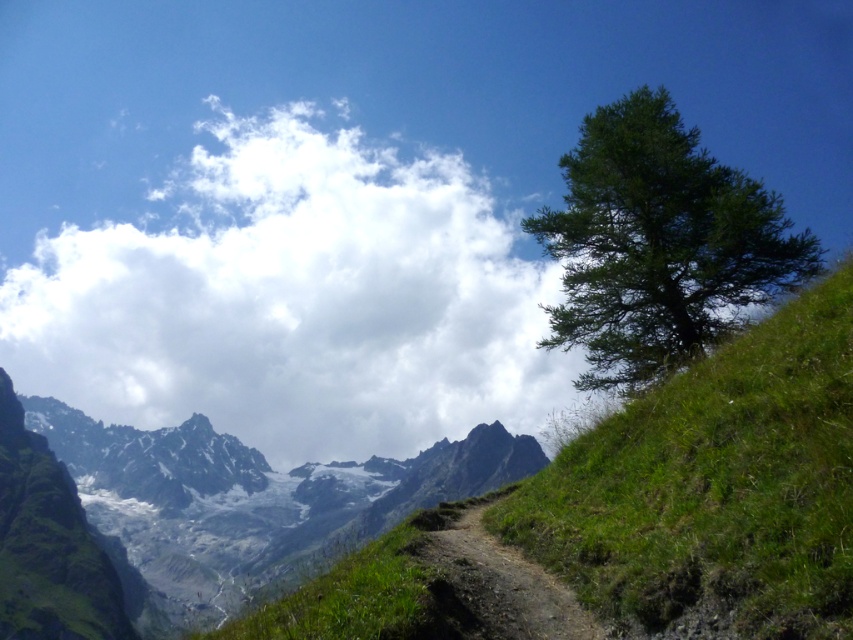
From the picture: Which is more to the right, green grassy hillside at right or snowy granite mountains at center?

green grassy hillside at right is more to the right.

Is point (796, 554) positioned after point (459, 493)?

No, it is in front of (459, 493).

Is point (846, 550) behind point (0, 417)?

No, (846, 550) is in front of (0, 417).

Identify the location of green grassy hillside at right. (715, 484).

Between green grassy hillside at right and dirt/gravel trail at lower center, which one is positioned lower?

Positioned lower is dirt/gravel trail at lower center.

Can you confirm if green grassy hillside at right is taller than dirt/gravel trail at lower center?

Indeed, green grassy hillside at right has a greater height compared to dirt/gravel trail at lower center.

Who is more forward, (711, 538) or (469, 614)?

Positioned in front is point (711, 538).

What are the coordinates of `green grassy hillside at right` in the screenshot? It's located at (715, 484).

Is point (430, 292) farther from viewer compared to point (645, 301)?

Yes, point (430, 292) is farther from viewer.

Is white fluffy cloud at upper center above green leafy tree at right?

No.

Is point (287, 156) positioned behind point (579, 224)?

Yes, it is behind point (579, 224).

At what (x,y) coordinates should I click in order to perform the action: click on white fluffy cloud at upper center. Please return your answer as a coordinate pair (x, y). Looking at the image, I should click on (294, 300).